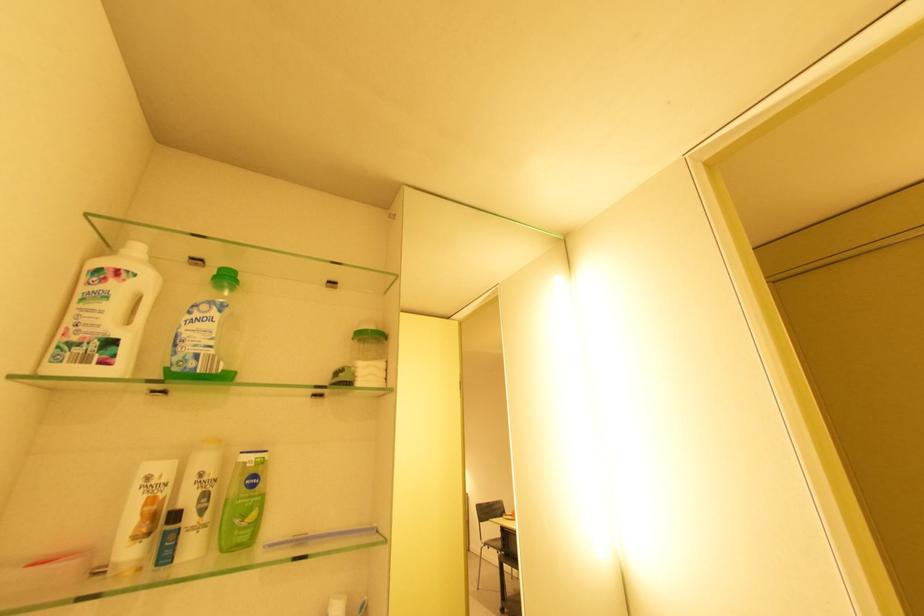
Where is `white bottle handle`? white bottle handle is located at coordinates (146, 302).